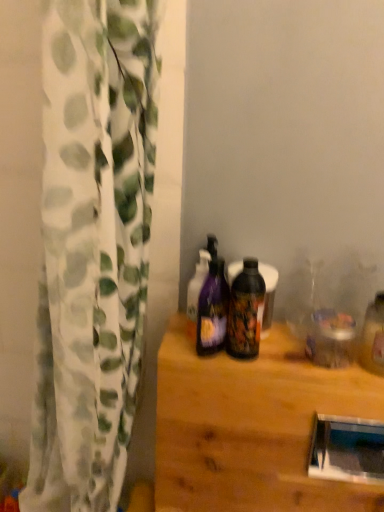
Question: Is glossy plastic bottle at center, which is the 2th bottle in left-to-right order, turned away from purple glossy bottle at center, the first bottle from the left?

Choices:
 (A) yes
 (B) no

Answer: (B)

Question: From a real-world perspective, does glossy plastic bottle at center, which is the 2th bottle in left-to-right order, sit lower than purple glossy bottle at center, the 2th bottle when ordered from right to left?

Choices:
 (A) no
 (B) yes

Answer: (A)

Question: Does glossy plastic bottle at center, which is the 2th bottle in left-to-right order, have a lesser height compared to purple glossy bottle at center, the first bottle from the left?

Choices:
 (A) yes
 (B) no

Answer: (A)

Question: From the image's perspective, is glossy plastic bottle at center, the first bottle in the right-to-left sequence, located beneath purple glossy bottle at center, the first bottle from the left?

Choices:
 (A) yes
 (B) no

Answer: (B)

Question: Considering the relative sizes of glossy plastic bottle at center, the first bottle in the right-to-left sequence, and purple glossy bottle at center, the 2th bottle when ordered from right to left, in the image provided, is glossy plastic bottle at center, the first bottle in the right-to-left sequence, smaller than purple glossy bottle at center, the 2th bottle when ordered from right to left,?

Choices:
 (A) no
 (B) yes

Answer: (B)

Question: Is glossy plastic bottle at center, the first bottle in the right-to-left sequence, far from purple glossy bottle at center, the 2th bottle when ordered from right to left?

Choices:
 (A) no
 (B) yes

Answer: (A)

Question: Considering the relative sizes of wooden table at center and white textured curtain at left in the image provided, is wooden table at center smaller than white textured curtain at left?

Choices:
 (A) no
 (B) yes

Answer: (B)

Question: From the image's perspective, is wooden table at center over white textured curtain at left?

Choices:
 (A) no
 (B) yes

Answer: (A)

Question: Is wooden table at center located outside white textured curtain at left?

Choices:
 (A) yes
 (B) no

Answer: (A)

Question: Is wooden table at center in contact with white textured curtain at left?

Choices:
 (A) yes
 (B) no

Answer: (B)

Question: Is wooden table at center wider than white textured curtain at left?

Choices:
 (A) yes
 (B) no

Answer: (B)

Question: Is wooden table at center positioned in front of white textured curtain at left?

Choices:
 (A) no
 (B) yes

Answer: (A)

Question: Is glossy plastic bottle at center, the first bottle in the right-to-left sequence, oriented away from white textured curtain at left?

Choices:
 (A) no
 (B) yes

Answer: (A)